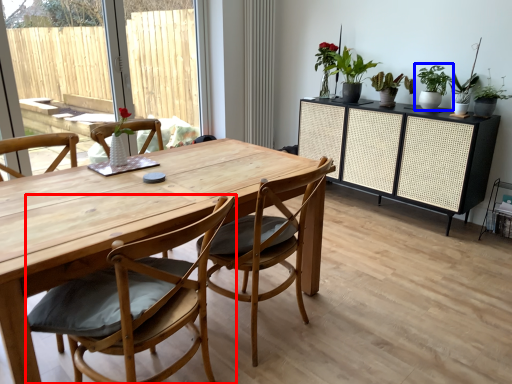
Question: Which object is further to the camera taking this photo, chair (highlighted by a red box) or houseplant (highlighted by a blue box)?

Choices:
 (A) chair
 (B) houseplant

Answer: (B)